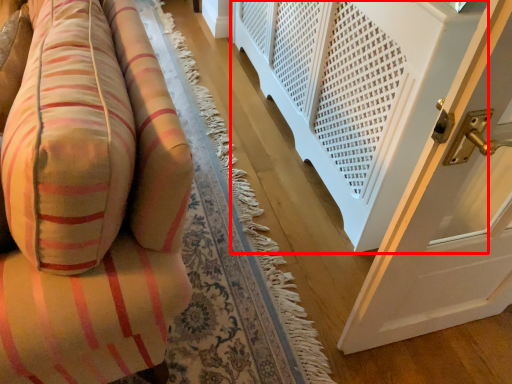
Question: Observing the image, what is the correct spatial positioning of balustrade (annotated by the red box) in reference to furniture?

Choices:
 (A) left
 (B) right

Answer: (B)